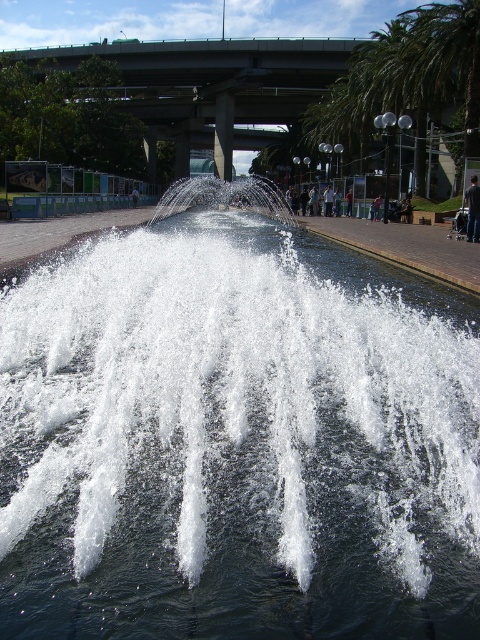
Describe the element at coordinates (266, 80) in the screenshot. The height and width of the screenshot is (640, 480). I see `concrete bridge at upper center` at that location.

Does point (394, 65) come behind point (468, 240)?

Yes, it is.

Is point (199, 80) closer to viewer compared to point (472, 211)?

No, (199, 80) is behind (472, 211).

Where is `concrete bridge at upper center`? concrete bridge at upper center is located at coordinates (266, 80).

Who is shorter, white frothy water at center or dark gray fabric at center?

dark gray fabric at center

Is white frothy water at center wider than dark gray fabric at center?

Indeed, white frothy water at center has a greater width compared to dark gray fabric at center.

Between point (194, 246) and point (477, 240), which one is positioned in front?

Point (194, 246) is in front.

At what (x,y) coordinates should I click in order to perform the action: click on white frothy water at center. Please return your answer as a coordinate pair (x, y). This screenshot has height=640, width=480. Looking at the image, I should click on (236, 436).

Which is more to the right, white frothy water at center or concrete bridge at upper center?

white frothy water at center is more to the right.

Between white frothy water at center and concrete bridge at upper center, which one is positioned lower?

Positioned lower is white frothy water at center.

What are the coordinates of `white frothy water at center` in the screenshot? It's located at (236, 436).

Image resolution: width=480 pixels, height=640 pixels. What are the coordinates of `white frothy water at center` in the screenshot? It's located at (236, 436).